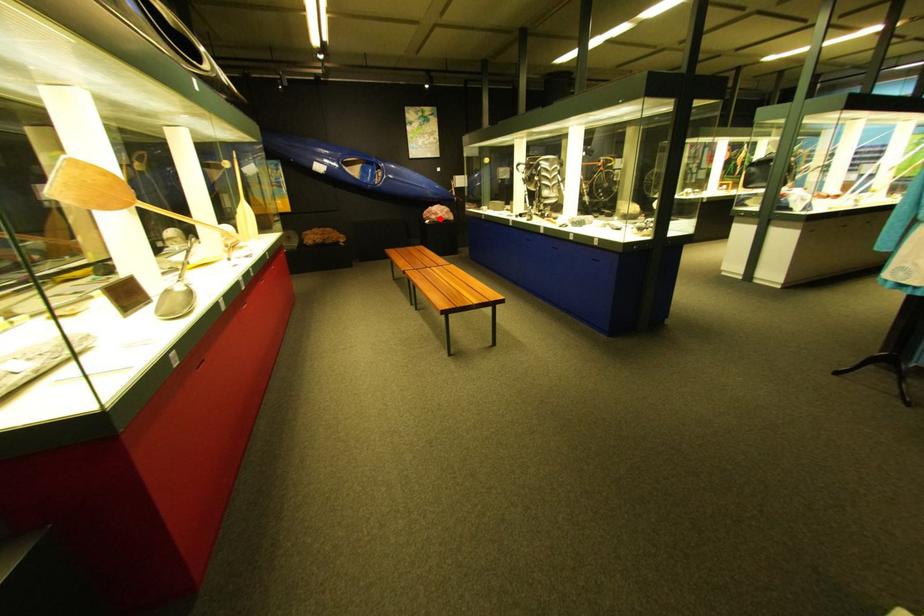
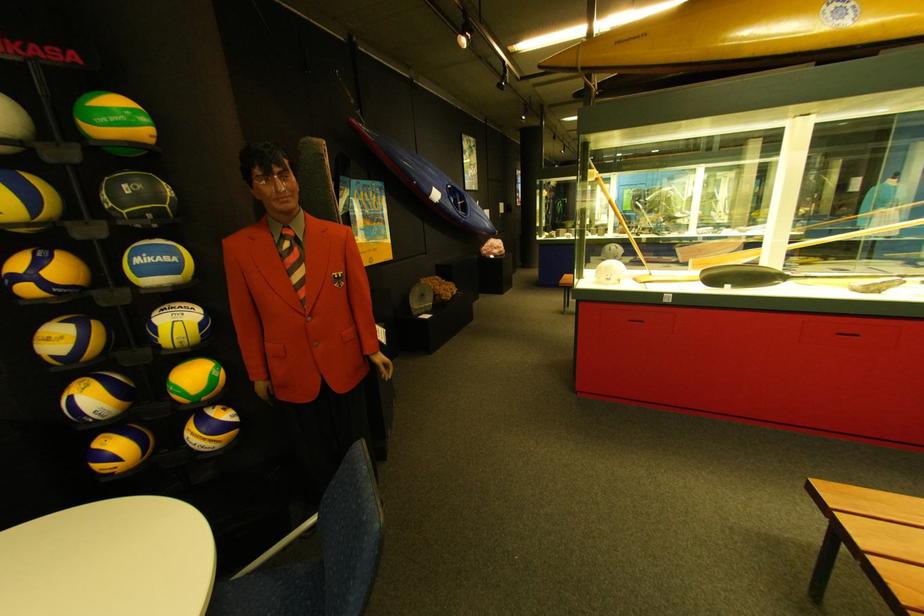
Where in the second image is the point corresponding to the highlighted location from the first image?

(500, 254)